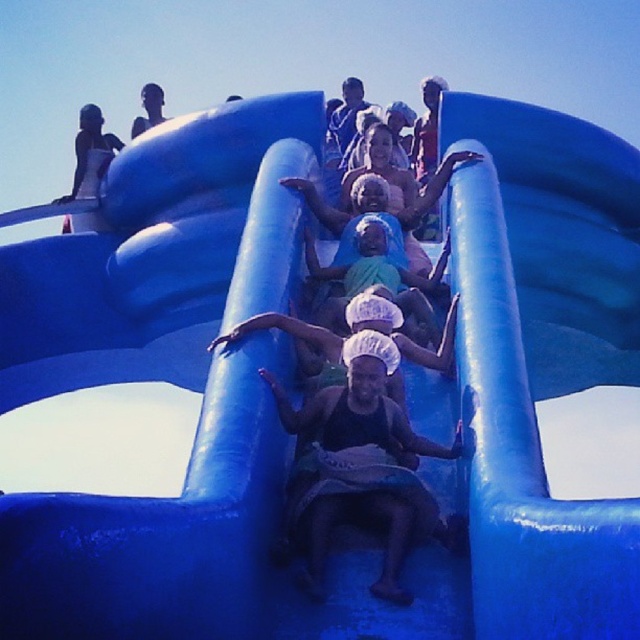
Between matte black towel at center and matte white swimsuit at upper left, which one has less height?

matte white swimsuit at upper left is shorter.

In the scene shown: Is matte black towel at center shorter than matte white swimsuit at upper left?

In fact, matte black towel at center may be taller than matte white swimsuit at upper left.

Does point (413, 522) come in front of point (102, 172)?

Yes, it is in front of point (102, 172).

The width and height of the screenshot is (640, 640). I want to click on matte black towel at center, so click(362, 461).

Is matte black towel at center to the left of matte black person at upper center from the viewer's perspective?

In fact, matte black towel at center is to the right of matte black person at upper center.

Between point (348, 358) and point (145, 84), which one is positioned in front?

Point (348, 358)

Locate an element on the screen. The height and width of the screenshot is (640, 640). matte black towel at center is located at coordinates (362, 461).

Describe the element at coordinates (90, 147) in the screenshot. I see `matte white swimsuit at upper left` at that location.

Can you confirm if matte white swimsuit at upper left is bigger than matte black person at upper center?

Yes, matte white swimsuit at upper left is bigger than matte black person at upper center.

Who is more forward, (x=52, y=202) or (x=134, y=118)?

Positioned in front is point (x=52, y=202).

At what (x,y) coordinates should I click in order to perform the action: click on matte white swimsuit at upper left. Please return your answer as a coordinate pair (x, y). The height and width of the screenshot is (640, 640). Looking at the image, I should click on (90, 147).